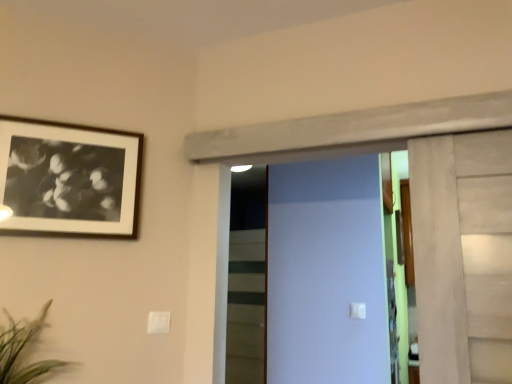
I want to click on black matte picture frame at upper left, so click(x=69, y=178).

Describe the element at coordinates (69, 178) in the screenshot. I see `black matte picture frame at upper left` at that location.

Based on the photo, what is the approximate height of black matte picture frame at upper left?

The height of black matte picture frame at upper left is 16.79 inches.

The height and width of the screenshot is (384, 512). I want to click on black matte picture frame at upper left, so click(x=69, y=178).